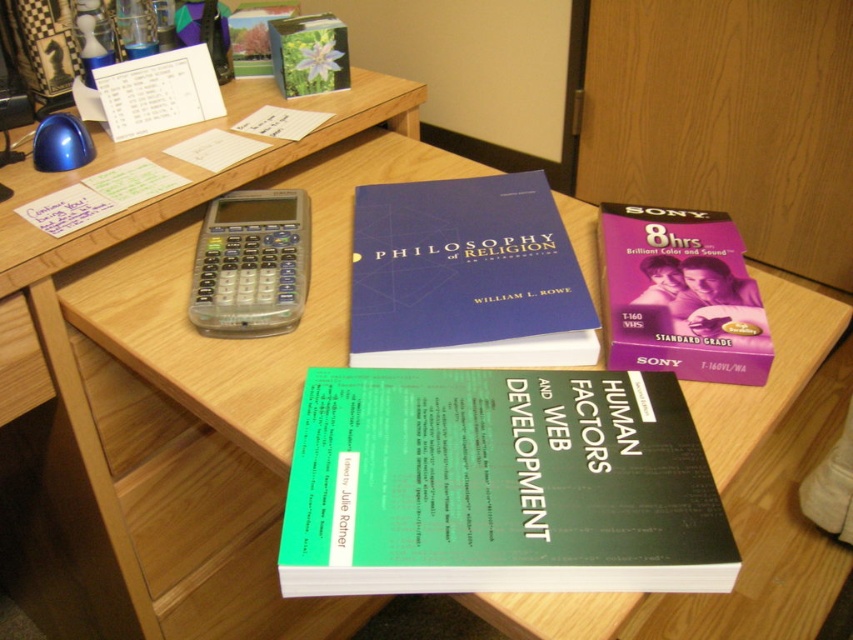
You are organizing items on a desk. You have a green matte book at center and a purple plastic tape at upper right. If you want to place them side by side in a drawer that can only hold items up to the combined width of both objects, will they fit if the drawer is 30 cm wide?

The green matte book at center is wider than the purple plastic tape at upper right. Since their combined width would exceed 30 cm, they might not fit. However, without exact measurements, we can only assume based on the given information that the book is wider, but cannot confirm the total.